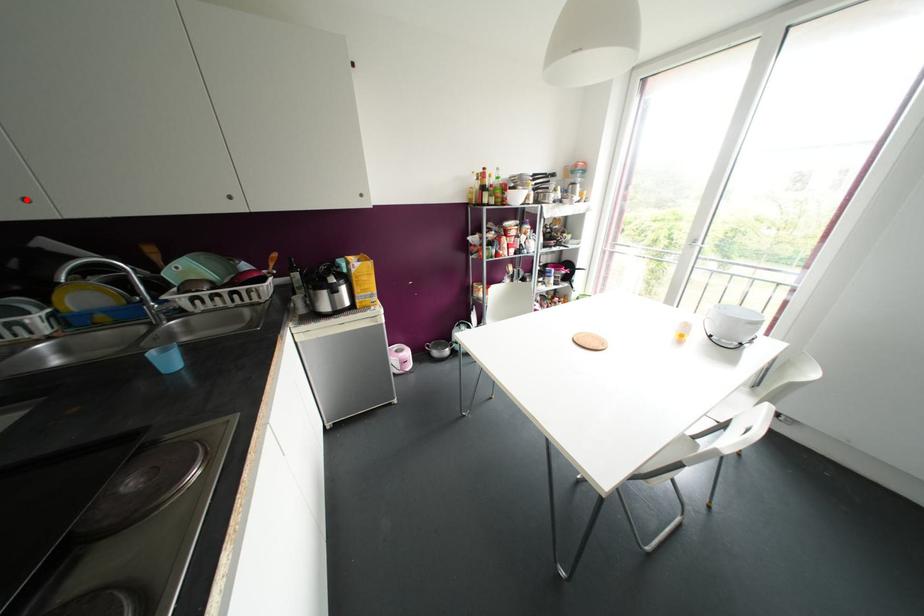
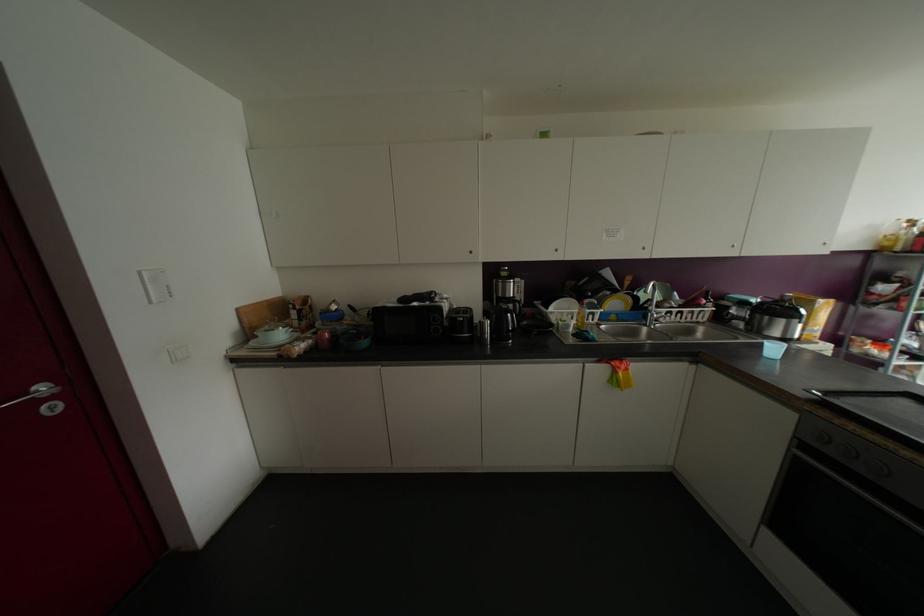
In the second image, find the point that corresponds to the highlighted location in the first image.

(642, 248)